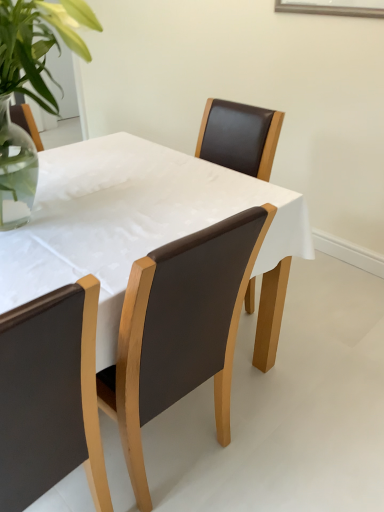
Question: Can you confirm if matte black chair at lower left, the 2th chair when ordered from right to left, is wider than matte brown table at center?

Choices:
 (A) yes
 (B) no

Answer: (B)

Question: Does matte black chair at lower left, arranged as the first chair when viewed from the left, come in front of matte brown table at center?

Choices:
 (A) no
 (B) yes

Answer: (B)

Question: From a real-world perspective, does matte black chair at lower left, arranged as the first chair when viewed from the left, sit lower than matte brown table at center?

Choices:
 (A) yes
 (B) no

Answer: (B)

Question: Can you confirm if matte black chair at lower left, the 2th chair when ordered from right to left, is shorter than matte brown table at center?

Choices:
 (A) no
 (B) yes

Answer: (A)

Question: Is matte black chair at lower left, arranged as the first chair when viewed from the left, located outside matte brown table at center?

Choices:
 (A) yes
 (B) no

Answer: (B)

Question: Is matte brown table at center at the back of matte black chair at lower left, arranged as the first chair when viewed from the left?

Choices:
 (A) no
 (B) yes

Answer: (B)

Question: From the image's perspective, is brown leather chair at center, acting as the 1th chair starting from the right, beneath matte black chair at lower left, the 2th chair when ordered from right to left?

Choices:
 (A) no
 (B) yes

Answer: (A)

Question: Is brown leather chair at center, the 2th chair in the left-to-right sequence, in front of matte black chair at lower left, the 2th chair when ordered from right to left?

Choices:
 (A) yes
 (B) no

Answer: (B)

Question: Is brown leather chair at center, the 2th chair in the left-to-right sequence, bigger than matte black chair at lower left, the 2th chair when ordered from right to left?

Choices:
 (A) yes
 (B) no

Answer: (A)

Question: Does brown leather chair at center, the 2th chair in the left-to-right sequence, appear on the left side of matte black chair at lower left, the 2th chair when ordered from right to left?

Choices:
 (A) yes
 (B) no

Answer: (B)

Question: Is brown leather chair at center, the 2th chair in the left-to-right sequence, outside matte black chair at lower left, arranged as the first chair when viewed from the left?

Choices:
 (A) yes
 (B) no

Answer: (A)

Question: Is brown leather chair at center, the 2th chair in the left-to-right sequence, smaller than matte black chair at lower left, arranged as the first chair when viewed from the left?

Choices:
 (A) no
 (B) yes

Answer: (A)

Question: Is matte black chair at lower left, the 2th chair when ordered from right to left, further to the viewer compared to brown leather chair at center, the 2th chair in the left-to-right sequence?

Choices:
 (A) no
 (B) yes

Answer: (A)